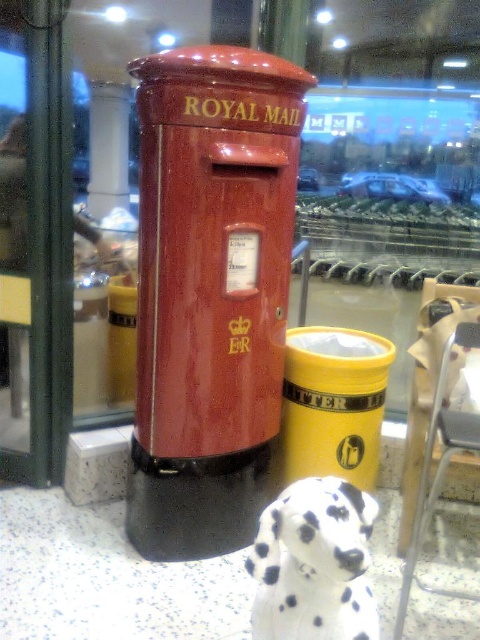
Which is in front, point (204, 68) or point (334, 481)?

Point (334, 481) is in front.

Is matte red mailbox at center further to the viewer compared to white-spotted fur dog at lower center?

That is True.

Locate an element on the screen. matte red mailbox at center is located at coordinates (211, 291).

Locate an element on the screen. The height and width of the screenshot is (640, 480). matte red mailbox at center is located at coordinates (211, 291).